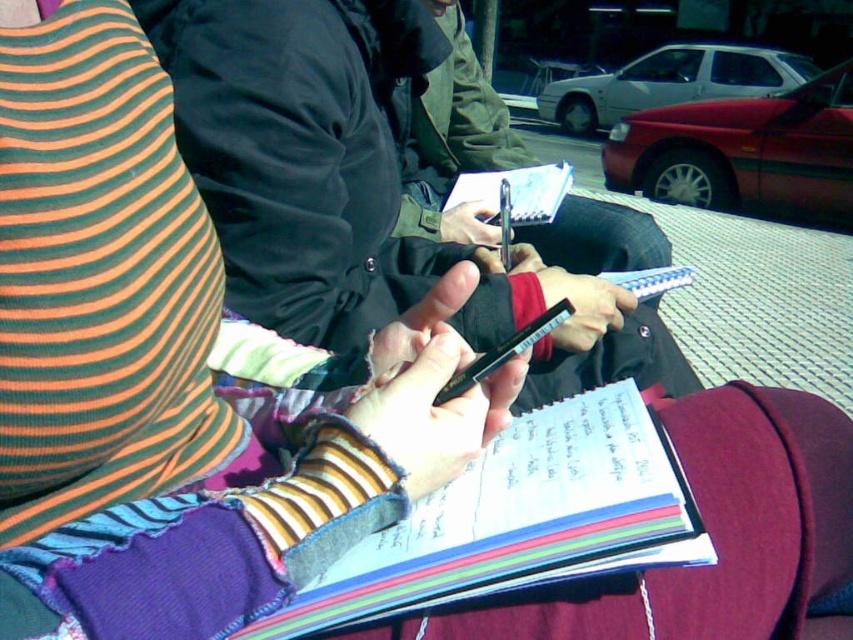
Can you confirm if black matte jacket at center is positioned to the right of green fabric jacket at center?

No, black matte jacket at center is not to the right of green fabric jacket at center.

Between point (283, 13) and point (601, 202), which one is positioned behind?

Positioned behind is point (601, 202).

At what (x,y) coordinates should I click in order to perform the action: click on black matte jacket at center. Please return your answer as a coordinate pair (x, y). This screenshot has width=853, height=640. Looking at the image, I should click on coord(361,189).

Consider the image. Between black matte jacket at center and white paper at center, which one has less height?

white paper at center is shorter.

Can you confirm if black matte jacket at center is positioned to the right of white paper at center?

In fact, black matte jacket at center is to the left of white paper at center.

Who is more forward, (263, 310) or (532, 218)?

Point (263, 310) is more forward.

At what (x,y) coordinates should I click in order to perform the action: click on black matte jacket at center. Please return your answer as a coordinate pair (x, y). Image resolution: width=853 pixels, height=640 pixels. Looking at the image, I should click on (361, 189).

Who is positioned more to the right, multicolored paper notebook at center or black plastic pen at center?

From the viewer's perspective, multicolored paper notebook at center appears more on the right side.

Who is more distant from viewer, (291,612) or (500,352)?

Positioned behind is point (500,352).

Where is `multicolored paper notebook at center`? Image resolution: width=853 pixels, height=640 pixels. multicolored paper notebook at center is located at coordinates click(519, 518).